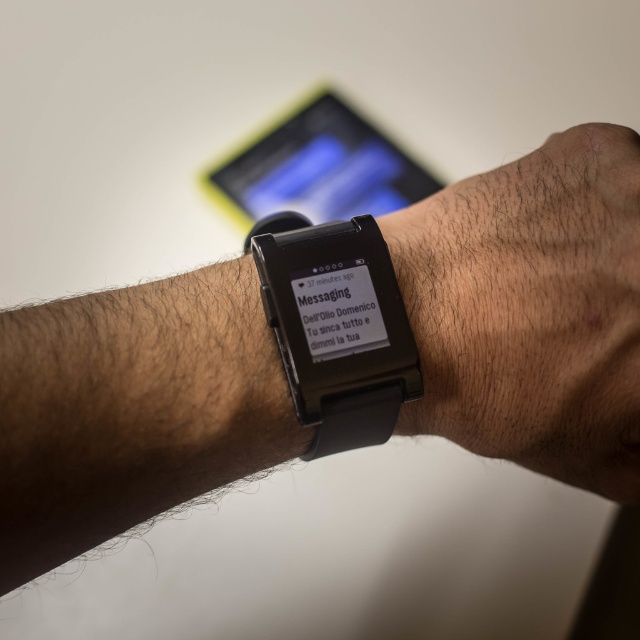
Question: Which of the following is the closest to the observer?

Choices:
 (A) black matte smartwatch at center
 (B) black rubber watch at center

Answer: (B)

Question: Observing the image, what is the correct spatial positioning of black matte watch at center in reference to black matte smartwatch at center?

Choices:
 (A) left
 (B) right

Answer: (B)

Question: Is black rubber watch at center to the right of black matte smartwatch at center from the viewer's perspective?

Choices:
 (A) no
 (B) yes

Answer: (A)

Question: Considering the relative positions of black matte watch at center and black rubber watch at center in the image provided, where is black matte watch at center located with respect to black rubber watch at center?

Choices:
 (A) below
 (B) above

Answer: (A)

Question: Estimate the real-world distances between objects in this image. Which object is closer to the black rubber watch at center?

Choices:
 (A) black matte watch at center
 (B) black matte smartwatch at center

Answer: (A)

Question: Estimate the real-world distances between objects in this image. Which object is farther from the black rubber watch at center?

Choices:
 (A) black matte watch at center
 (B) black matte smartwatch at center

Answer: (B)